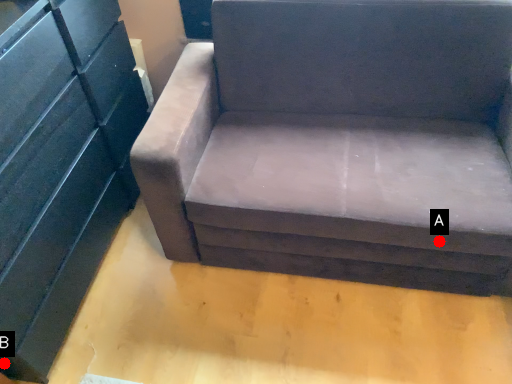
Question: Two points are circled on the image, labeled by A and B beside each circle. Which point is farther from the camera taking this photo?

Choices:
 (A) A is further
 (B) B is further

Answer: (B)